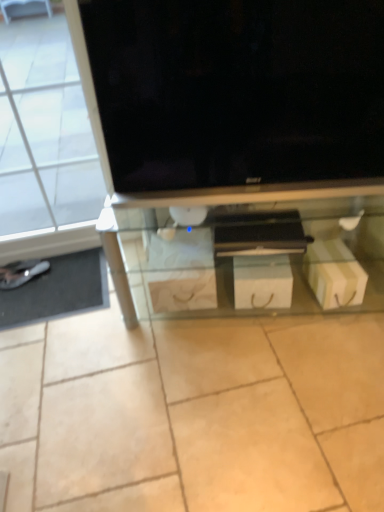
Question: Is white cardboard drawer at center looking in the opposite direction of transparent glass shelf at center?

Choices:
 (A) no
 (B) yes

Answer: (B)

Question: Is white cardboard drawer at center beside transparent glass shelf at center?

Choices:
 (A) yes
 (B) no

Answer: (B)

Question: Is white cardboard drawer at center positioned far away from transparent glass shelf at center?

Choices:
 (A) yes
 (B) no

Answer: (B)

Question: From a real-world perspective, is white cardboard drawer at center positioned over transparent glass shelf at center based on gravity?

Choices:
 (A) no
 (B) yes

Answer: (A)

Question: Considering the relative positions of white cardboard drawer at center and transparent glass shelf at center in the image provided, is white cardboard drawer at center to the left of transparent glass shelf at center from the viewer's perspective?

Choices:
 (A) yes
 (B) no

Answer: (B)

Question: Considering the positions of white cardboard drawer at center and transparent glass door at left in the image, is white cardboard drawer at center bigger or smaller than transparent glass door at left?

Choices:
 (A) big
 (B) small

Answer: (B)

Question: Is white cardboard drawer at center to the left or to the right of transparent glass door at left in the image?

Choices:
 (A) right
 (B) left

Answer: (A)

Question: Does point (215, 231) appear closer or farther from the camera than point (51, 96)?

Choices:
 (A) farther
 (B) closer

Answer: (B)

Question: In the image, is white cardboard drawer at center positioned in front of or behind transparent glass door at left?

Choices:
 (A) behind
 (B) front

Answer: (A)

Question: Based on their sizes in the image, would you say transparent glass shelf at center is bigger or smaller than metallic silver flat at lower left?

Choices:
 (A) small
 (B) big

Answer: (B)

Question: Is point (200, 237) closer or farther from the camera than point (41, 287)?

Choices:
 (A) farther
 (B) closer

Answer: (B)

Question: Is transparent glass shelf at center taller or shorter than metallic silver flat at lower left?

Choices:
 (A) short
 (B) tall

Answer: (B)

Question: Looking at their shapes, would you say transparent glass shelf at center is wider or thinner than metallic silver flat at lower left?

Choices:
 (A) thin
 (B) wide

Answer: (B)

Question: In the image, is transparent glass door at left positioned in front of or behind shiny silver shoe at lower left?

Choices:
 (A) behind
 (B) front

Answer: (B)

Question: From the image's perspective, is transparent glass door at left above or below shiny silver shoe at lower left?

Choices:
 (A) above
 (B) below

Answer: (A)